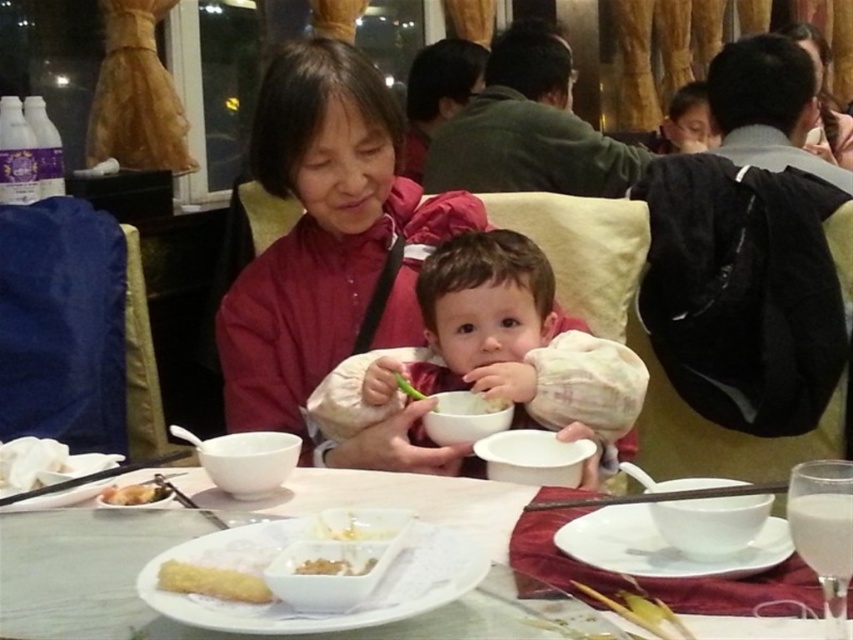
Question: Among these points, which one is nearest to the camera?

Choices:
 (A) (335, 99)
 (B) (253, 579)
 (C) (108, 506)

Answer: (B)

Question: Which point is farther from the camera taking this photo?

Choices:
 (A) (115, 492)
 (B) (602, 504)
 (C) (379, 268)
 (D) (323, 566)

Answer: (C)

Question: Is black plastic chopsticks at upper center positioned in front of golden fried pastry at lower left?

Choices:
 (A) yes
 (B) no

Answer: (A)

Question: Does golden crispy pastry at lower left appear on the right side of wooden chopsticks at lower left?

Choices:
 (A) no
 (B) yes

Answer: (B)

Question: Is white glossy table at center bigger than crumbly yellow bread at center?

Choices:
 (A) no
 (B) yes

Answer: (B)

Question: Which point is closer to the camera taking this photo?

Choices:
 (A) (64, 634)
 (B) (144, 506)
 (C) (21, 497)
 (D) (555, 401)

Answer: (A)